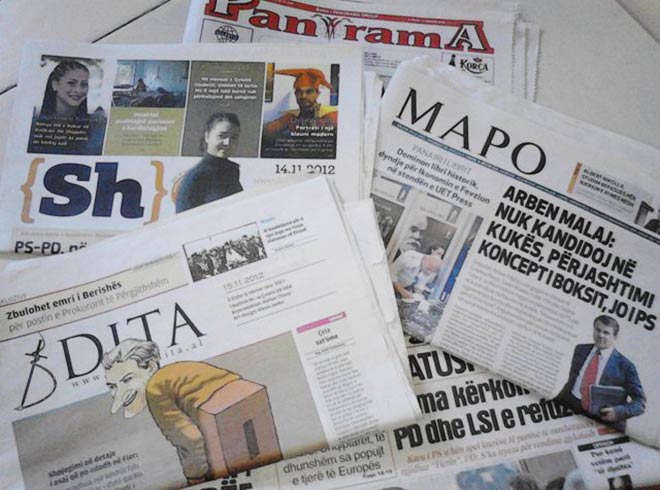
The height and width of the screenshot is (490, 660). I want to click on newspapers, so click(x=208, y=105), click(x=360, y=14), click(x=484, y=209), click(x=230, y=354), click(x=478, y=427).